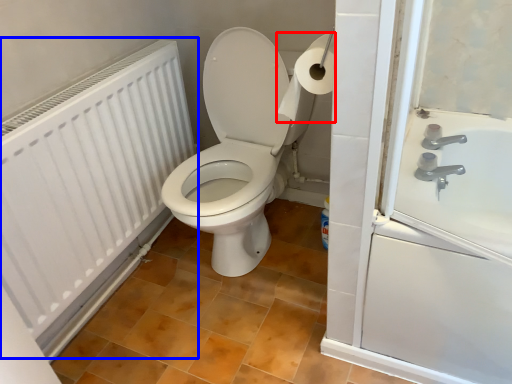
Question: Which object is closer to the camera taking this photo, toilet paper (highlighted by a red box) or radiator (highlighted by a blue box)?

Choices:
 (A) toilet paper
 (B) radiator

Answer: (B)